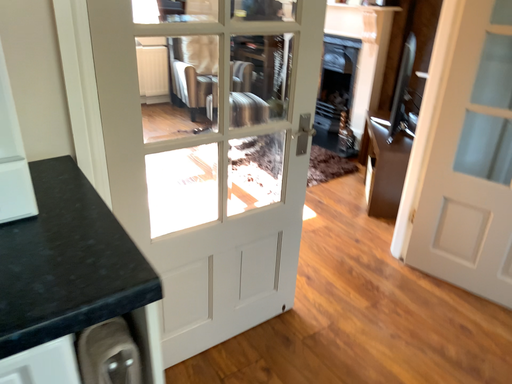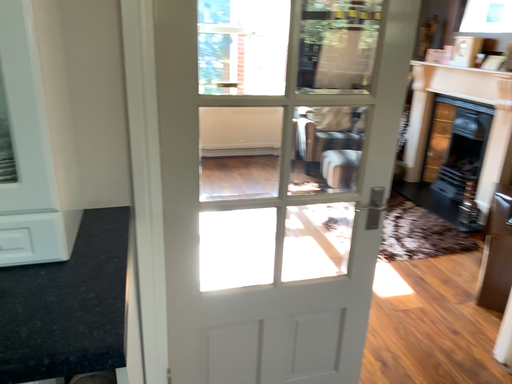
Question: Which way did the camera rotate in the video?

Choices:
 (A) rotated left
 (B) rotated right

Answer: (A)